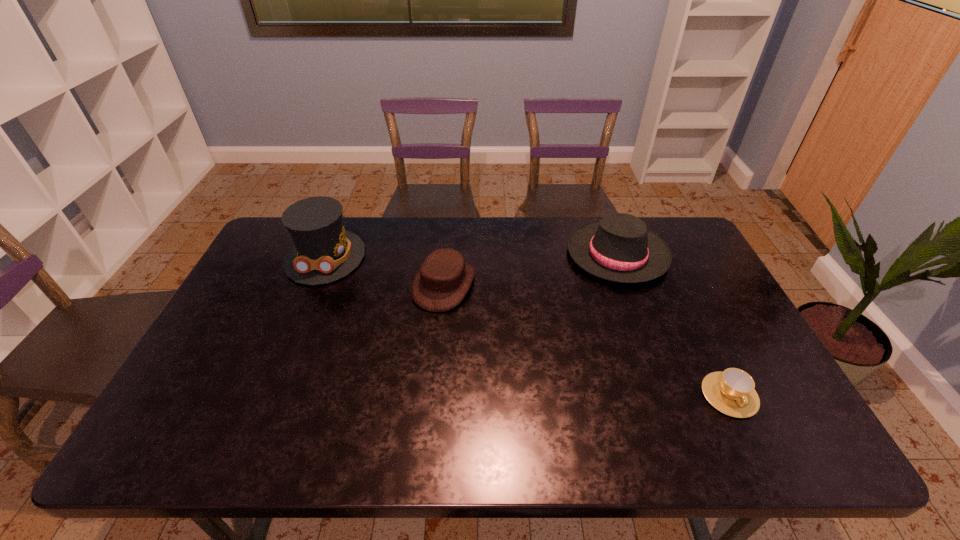
Where is `the leftmost hat`? the leftmost hat is located at coordinates (323, 252).

At what (x,y) coordinates should I click in order to perform the action: click on the tallest hat. Please return your answer as a coordinate pair (x, y). Looking at the image, I should click on (323, 252).

I want to click on the third shortest object, so click(619, 248).

The width and height of the screenshot is (960, 540). What are the coordinates of `the second tallest hat` in the screenshot? It's located at (619, 248).

Where is `the third tallest object`? This screenshot has width=960, height=540. the third tallest object is located at coordinates (442, 282).

Find the location of a particular element. the shortest hat is located at coordinates (442, 282).

At what (x,y) coordinates should I click in order to perform the action: click on the nearest object. Please return your answer as a coordinate pair (x, y). Looking at the image, I should click on (732, 392).

The width and height of the screenshot is (960, 540). Identify the location of cup. (732, 392).

Find the location of a particular element. Image resolution: width=960 pixels, height=540 pixels. vacant area located 0.300m with goggles on the front of the leftmost hat is located at coordinates (280, 368).

Identify the location of vacant region located 0.070m on the front of the second tallest hat. Image resolution: width=960 pixels, height=540 pixels. (636, 305).